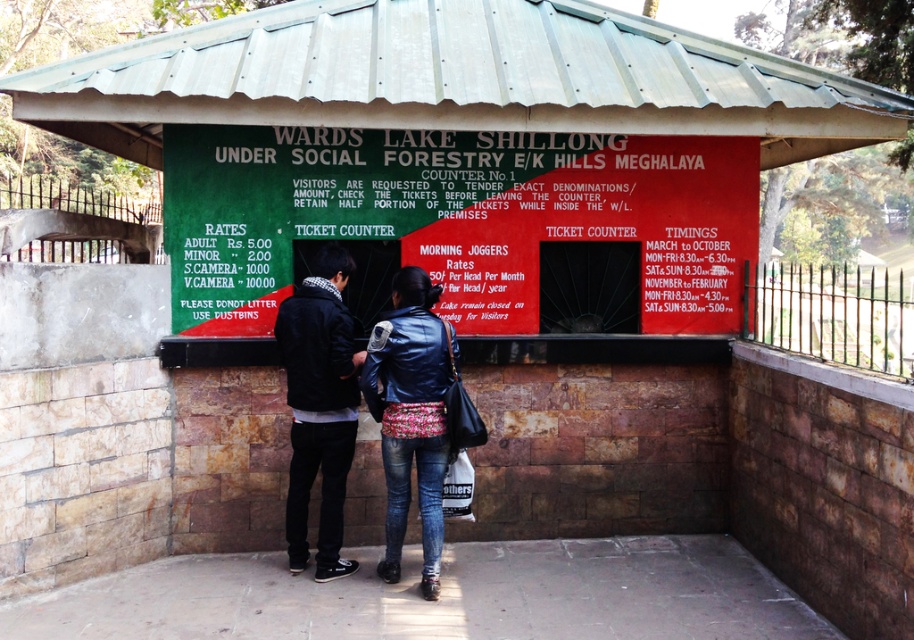
You are standing at the ticket counter at Wards Lake Shillong. You see a dark blue leather jacket at center. Where exactly is the dark blue leather jacket located in terms of coordinates?

The dark blue leather jacket at center is located at point coordinates of (411, 413).

You are standing at the ticket counter at Wards Lake Shillong and want to reach the point marked as point [389,209]. However, there is an obstacle at point [339,570]. Can you go around the obstacle to reach your destination?

Point [389,209] is behind point [339,570], so you can go around the obstacle at point [339,570] to reach your destination.